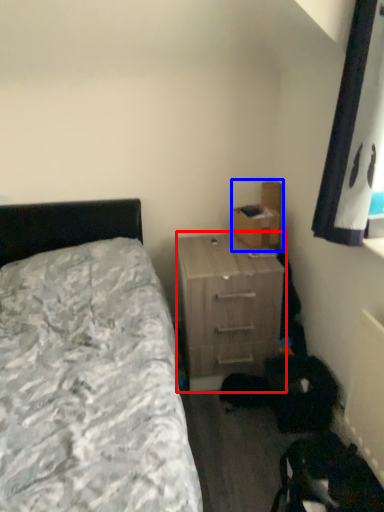
Question: Which object is further to the camera taking this photo, nightstand (highlighted by a red box) or cardboard box (highlighted by a blue box)?

Choices:
 (A) nightstand
 (B) cardboard box

Answer: (B)